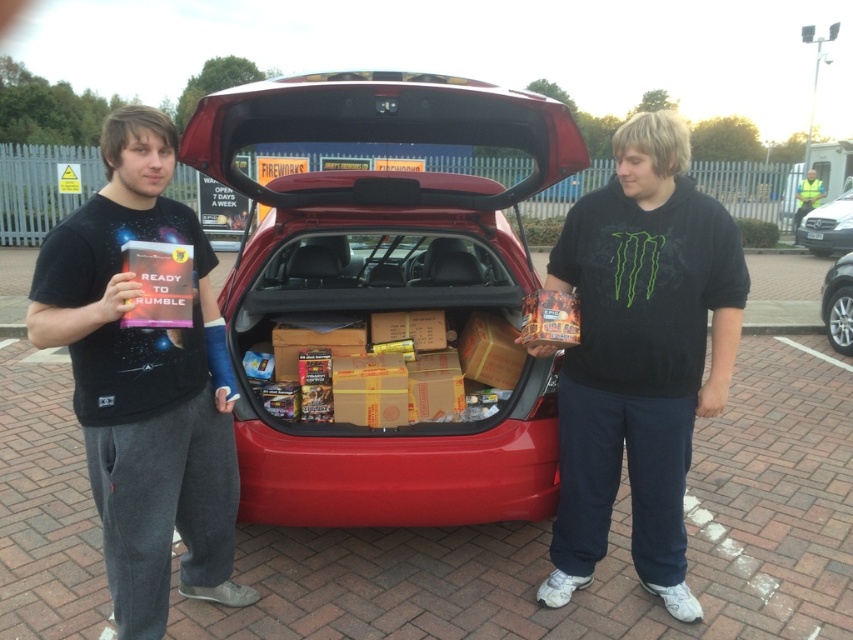
Consider the image. You are standing in front of the car trunk and want to reach both points marked in the image. Which point, point (566, 480) or point (822, 189), is closer to you?

Point (566, 480) is closer to the viewer than point (822, 189).